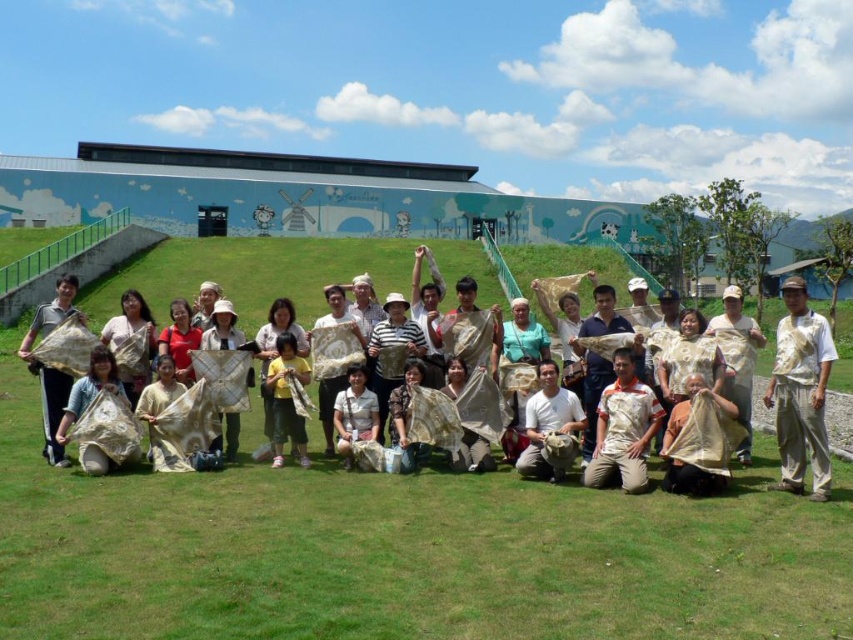
Can you confirm if green grass at center is positioned below matte beige fabric at lower left?

Yes, green grass at center is below matte beige fabric at lower left.

Is green grass at center to the right of matte beige fabric at lower left from the viewer's perspective?

Yes, green grass at center is to the right of matte beige fabric at lower left.

Between point (39, 576) and point (51, 422), which one is positioned in front?

Point (39, 576) is in front.

Locate an element on the screen. The width and height of the screenshot is (853, 640). green grass at center is located at coordinates (399, 552).

Does light brown fabric at center have a greater height compared to yellow fabric at center?

Incorrect, light brown fabric at center's height is not larger of yellow fabric at center's.

The image size is (853, 640). I want to click on light brown fabric at center, so click(x=624, y=428).

This screenshot has height=640, width=853. In order to click on light brown fabric at center in this screenshot , I will do `click(624, 428)`.

Is beige fabric hat at center in front of yellow fabric at center?

Yes, it is in front of yellow fabric at center.

Which of these two, beige fabric hat at center or yellow fabric at center, stands shorter?

yellow fabric at center

Does point (827, 323) come in front of point (274, 413)?

Yes, point (827, 323) is closer to viewer.

Find the location of a particular element. beige fabric hat at center is located at coordinates (801, 392).